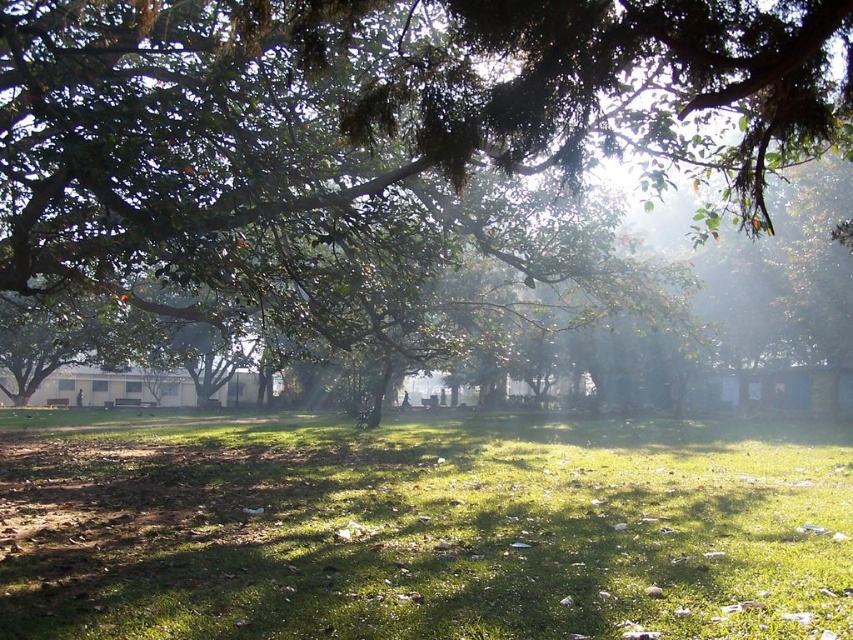
Question: Among these points, which one is farthest from the camera?

Choices:
 (A) (206, 461)
 (B) (24, 35)

Answer: (A)

Question: Does green grass at center come in front of green leafy tree at center?

Choices:
 (A) no
 (B) yes

Answer: (A)

Question: Is green grass at center thinner than green leafy tree at center?

Choices:
 (A) yes
 (B) no

Answer: (B)

Question: Which of the following is the closest to the observer?

Choices:
 (A) green grass at center
 (B) green leafy tree at center

Answer: (B)

Question: Where is green grass at center located in relation to green leafy tree at center in the image?

Choices:
 (A) left
 (B) right

Answer: (A)